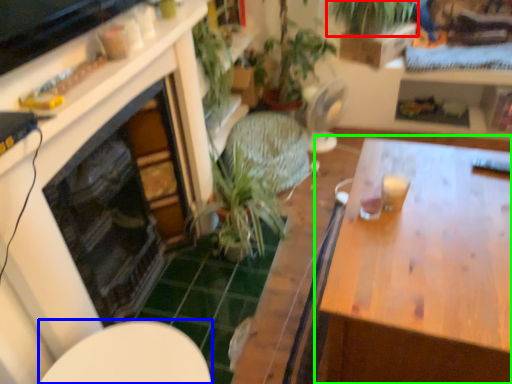
Question: Which is farther away from vegetation (highlighted by a red box)? round table (highlighted by a blue box) or table (highlighted by a green box)?

Choices:
 (A) round table
 (B) table

Answer: (A)